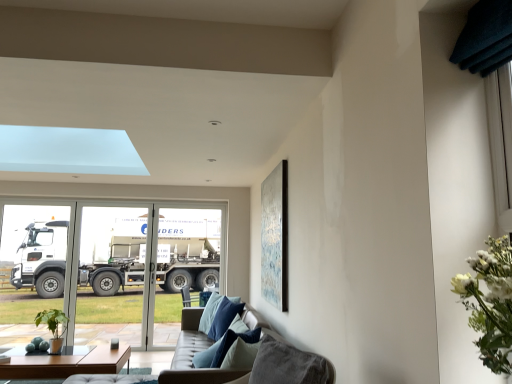
Question: Do you think matte black coffee table at lower left is within leather couch at lower center, or outside of it?

Choices:
 (A) outside
 (B) inside

Answer: (A)

Question: Is point (41, 372) positioned closer to the camera than point (224, 372)?

Choices:
 (A) farther
 (B) closer

Answer: (A)

Question: Which of these objects is positioned closest to the leather couch at lower center?

Choices:
 (A) matte black coffee table at lower left
 (B) white metallic truck at left
 (C) blue velvet pillow at center
 (D) metallic silver picture frame at upper right
 (E) transparent glass screen door at left, the second screen door from the right

Answer: (C)

Question: Which is farther from the transparent glass screen door at left, the second screen door from the right?

Choices:
 (A) white metallic truck at left
 (B) green matte plant at lower left
 (C) blue velvet pillow at center
 (D) matte black coffee table at lower left
 (E) metallic silver picture frame at upper right

Answer: (C)